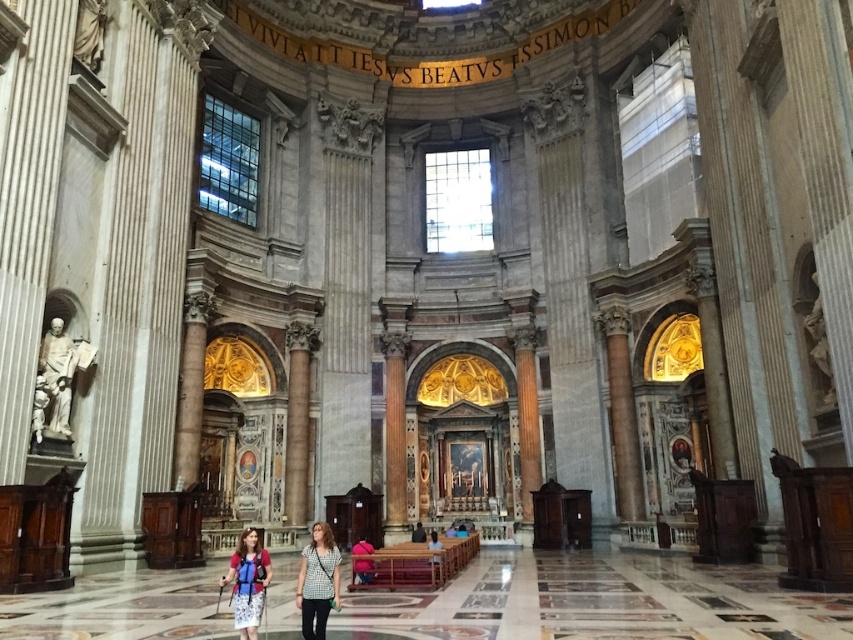
Is checkered fabric shirt at center shorter than matte black backpack at center?

In fact, checkered fabric shirt at center may be taller than matte black backpack at center.

Find the location of a particular element. This screenshot has width=853, height=640. checkered fabric shirt at center is located at coordinates (317, 580).

Between white marble statue at left and matte pink sweater at center, which one has more height?

matte pink sweater at center is taller.

This screenshot has height=640, width=853. I want to click on white marble statue at left, so click(x=56, y=376).

Can you confirm if white marble statue at left is bigger than matte blue dress at center?

Incorrect, white marble statue at left is not larger than matte blue dress at center.

Locate an element on the screen. white marble statue at left is located at coordinates (56, 376).

Describe the element at coordinates (56, 376) in the screenshot. I see `white marble statue at left` at that location.

At what (x,y) coordinates should I click in order to perform the action: click on white marble statue at left. Please return your answer as a coordinate pair (x, y). The image size is (853, 640). Looking at the image, I should click on (56, 376).